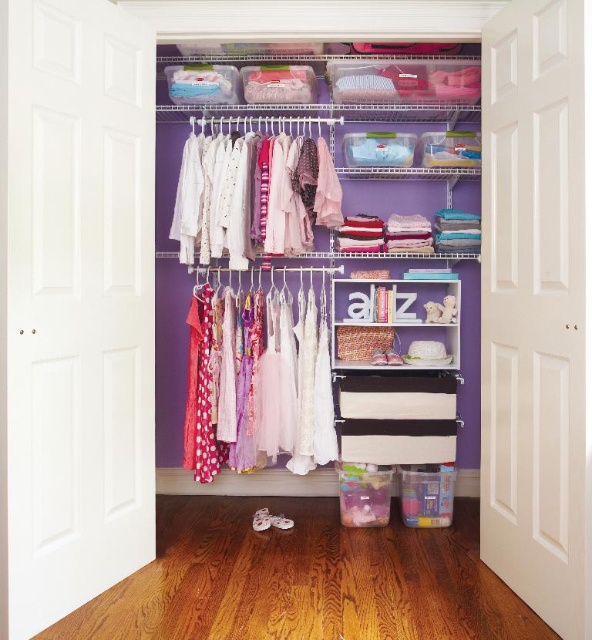
Does matte plastic storage bins at upper center have a greater height compared to matte white shirts at center?

Correct, matte plastic storage bins at upper center is much taller as matte white shirts at center.

Does matte plastic storage bins at upper center appear under matte white shirts at center?

Yes.

The width and height of the screenshot is (592, 640). I want to click on matte plastic storage bins at upper center, so click(x=339, y=243).

Where is `matte plastic storage bins at upper center`? The image size is (592, 640). matte plastic storage bins at upper center is located at coordinates (339, 243).

Is polka dot fabric dresses at center to the right of matte white shirts at center from the viewer's perspective?

Correct, you'll find polka dot fabric dresses at center to the right of matte white shirts at center.

Is polka dot fabric dresses at center bigger than matte white shirts at center?

Correct, polka dot fabric dresses at center is larger in size than matte white shirts at center.

The width and height of the screenshot is (592, 640). In order to click on polka dot fabric dresses at center in this screenshot , I will do `click(260, 385)`.

Where is `polka dot fabric dresses at center`? The image size is (592, 640). polka dot fabric dresses at center is located at coordinates (260, 385).

Between polka dot fabric dresses at center and white matte shelf at center, which one is positioned lower?

polka dot fabric dresses at center

Locate an element on the screen. polka dot fabric dresses at center is located at coordinates (260, 385).

Locate an element on the screen. Image resolution: width=592 pixels, height=640 pixels. polka dot fabric dresses at center is located at coordinates (260, 385).